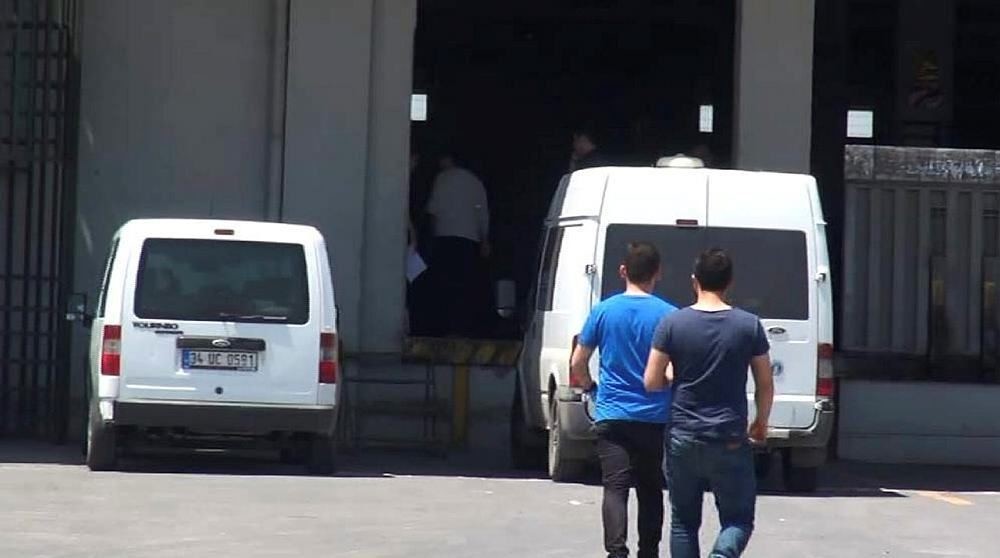
What are the coordinates of `window` in the screenshot? It's located at (847, 119), (706, 124), (413, 107).